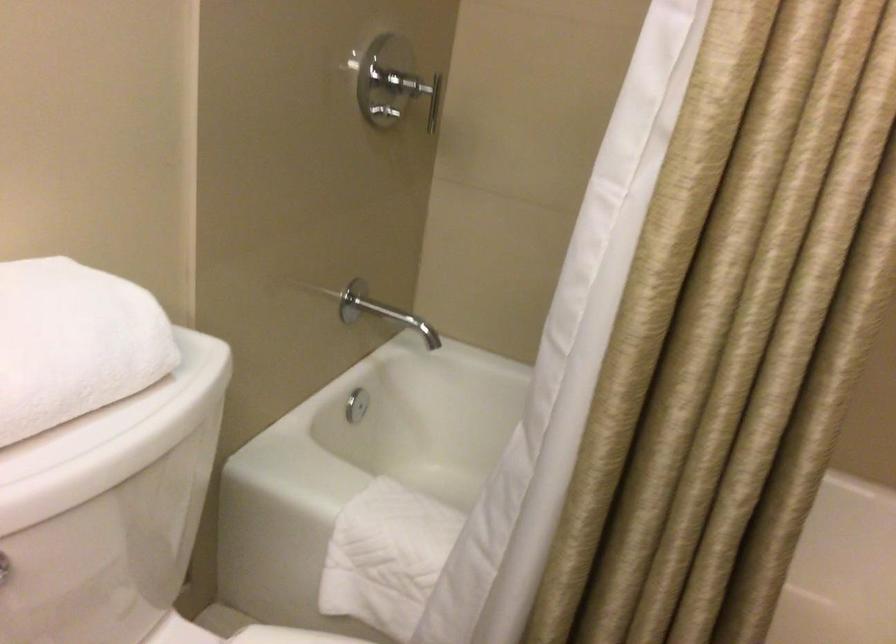
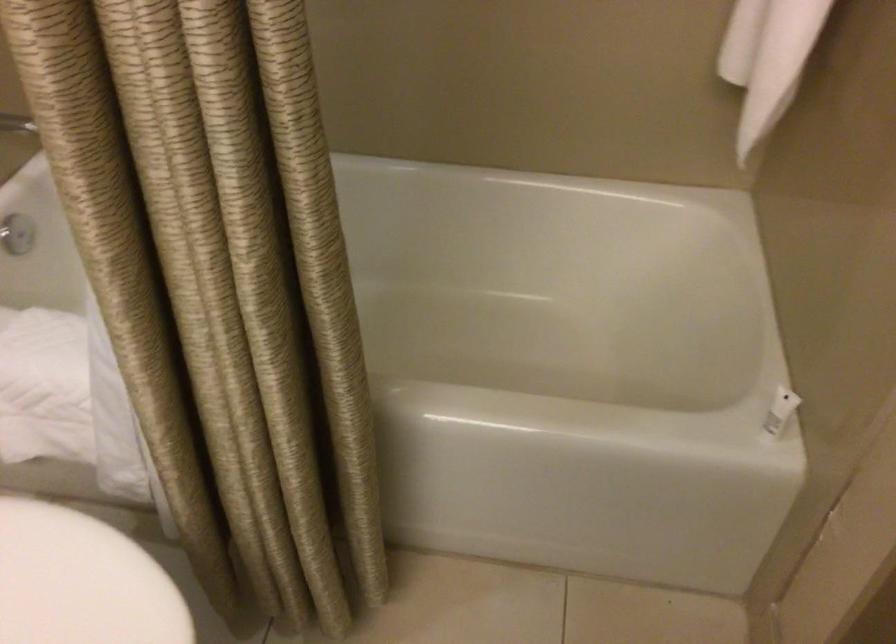
Question: Which direction would the cameraman need to move to produce the second image? Reply with the corresponding letter.

Choices:
 (A) Left
 (B) Right
 (C) Forward
 (D) Backward

Answer: (B)